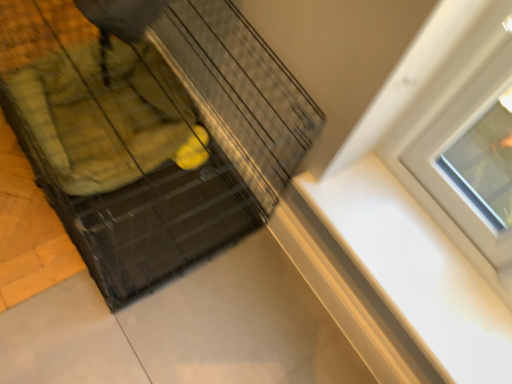
Locate an element on the screen. This screenshot has height=384, width=512. free point above white glossy window sill at upper right (from a real-world perspective) is located at coordinates (412, 260).